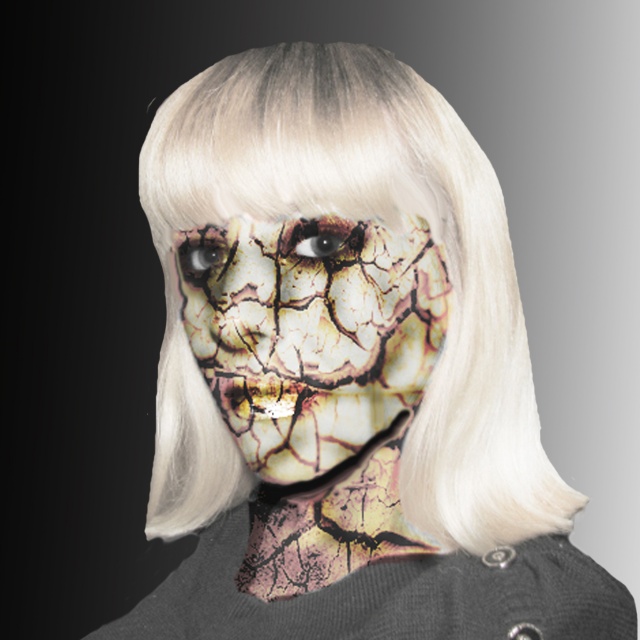
Based on the photo, you are an artist analyzing a portrait. You notice the cracked clay mask at center and the brown textured eye at center. Based on their positions, which object is closer to the bottom of the face?

The cracked clay mask at center is located below the brown textured eye at center, so it is closer to the bottom of the face.

You are an artist trying to sketch this person. You notice two points on their sweater at coordinates point (157, 387) and point (282, 236). Which point should you shade more to create a sense of depth?

Point (157, 387) is further to the viewer than point (282, 236). To create a sense of depth, you should shade more on point (282, 236) since it is farther away and would naturally be less illuminated.

You are a photographer adjusting your camera settings to focus on two points in the image. The first point is at coordinate point (365, 413), and the second is at coordinate point (220, 260). Which point should you focus on first if you want to ensure the closest object is in sharp focus?

You should focus on point (365, 413) first because it is closer to the viewer than point (220, 260), ensuring the closest object is in sharp focus.